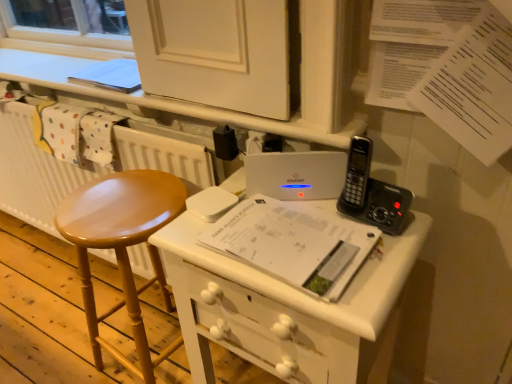
Find the location of a particular element. The image size is (512, 384). free spot to the left of shiny wood stool at left is located at coordinates (61, 347).